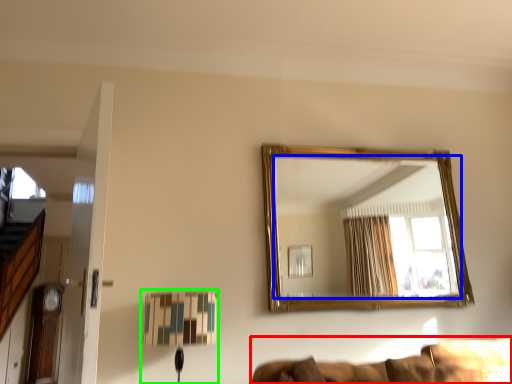
Question: Which is farther away from couch (highlighted by a red box)? mirror (highlighted by a blue box) or table lamp (highlighted by a green box)?

Choices:
 (A) mirror
 (B) table lamp

Answer: (A)